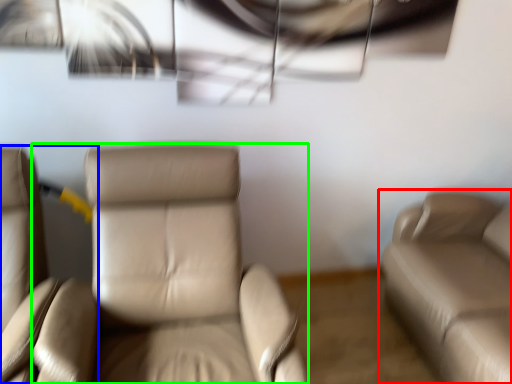
Question: Which is nearer to the studio couch (highlighted by a red box)? chair (highlighted by a blue box) or chair (highlighted by a green box).

Choices:
 (A) chair
 (B) chair

Answer: (B)